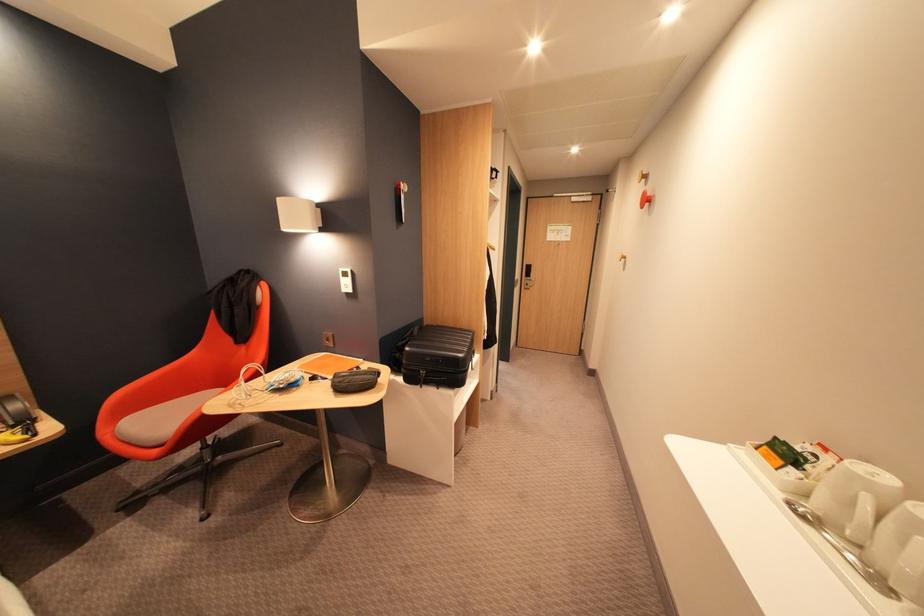
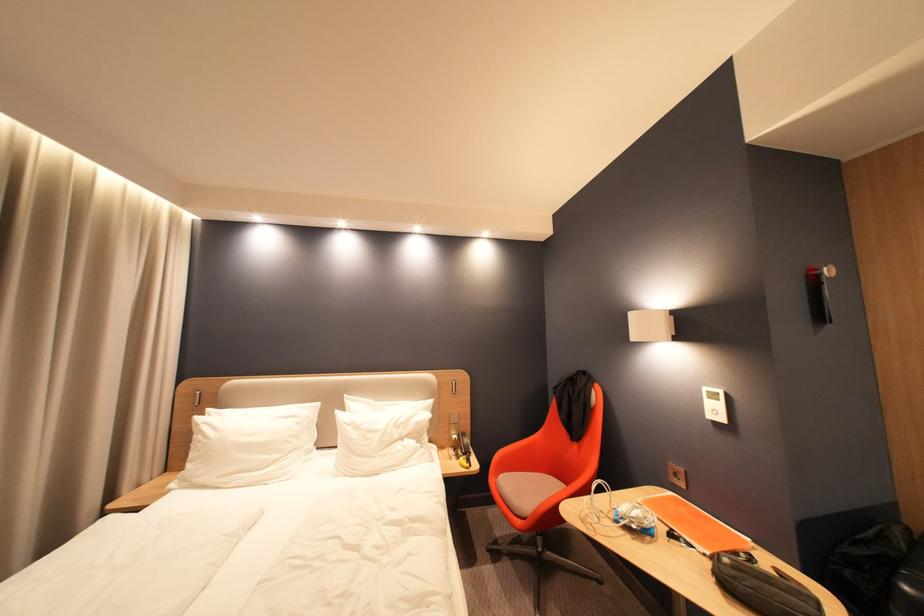
Find the pixel in the second image that matches pixel 410 185 in the first image.

(830, 270)